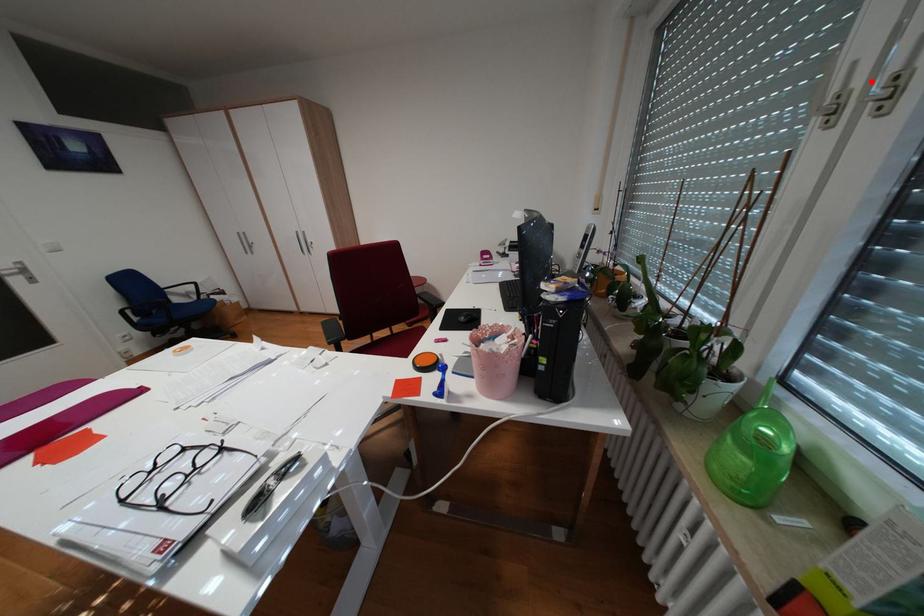
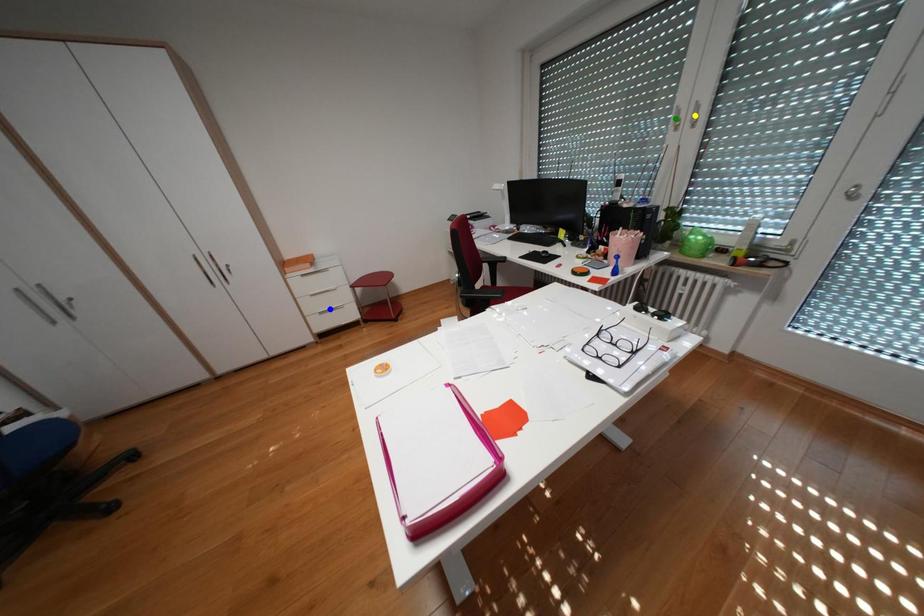
Question: I am providing you with two images of the same scene from different viewpoints. A red point is marked on the first image. You are given multiple points on the second image. In image 2, which mark is for the same physical point as the one in image 1?

Choices:
 (A) blue point
 (B) green point
 (C) yellow point

Answer: (C)